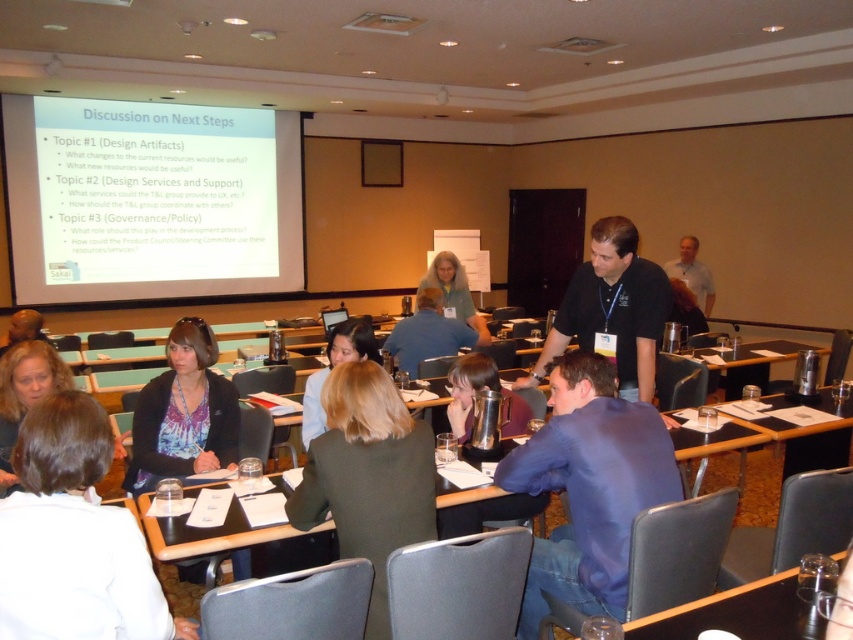
Which of these two, matte black jacket at center or wooden table at lower right, stands taller?

matte black jacket at center

I want to click on matte black jacket at center, so click(183, 412).

You are a GUI agent. You are given a task and a screenshot of the screen. Output one action in this format:
    pyautogui.click(x=<x>, y=<y>)
    Task: Click on the matte black jacket at center
    
    Given the screenshot: What is the action you would take?
    pyautogui.click(x=183, y=412)

Is point (44, 264) farther from camera compared to point (688, 288)?

Yes, it is.

Is point (141, 147) closer to viewer compared to point (692, 291)?

No, it is behind (692, 291).

Identify the location of white matte projector screen at upper left. This screenshot has width=853, height=640. (149, 200).

Identify the location of white matte projector screen at upper left. (149, 200).

Which of these two, white matte projector screen at upper left or blonde hair at lower left, stands taller?

Standing taller between the two is white matte projector screen at upper left.

Can you confirm if white matte projector screen at upper left is taller than blonde hair at lower left?

Correct, white matte projector screen at upper left is much taller as blonde hair at lower left.

Image resolution: width=853 pixels, height=640 pixels. In order to click on white matte projector screen at upper left in this screenshot , I will do `click(149, 200)`.